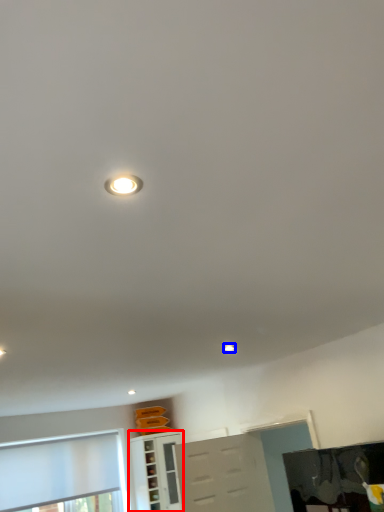
Question: Among these objects, which one is nearest to the camera, cabinetry (highlighted by a red box) or droplight (highlighted by a blue box)?

Choices:
 (A) cabinetry
 (B) droplight

Answer: (B)